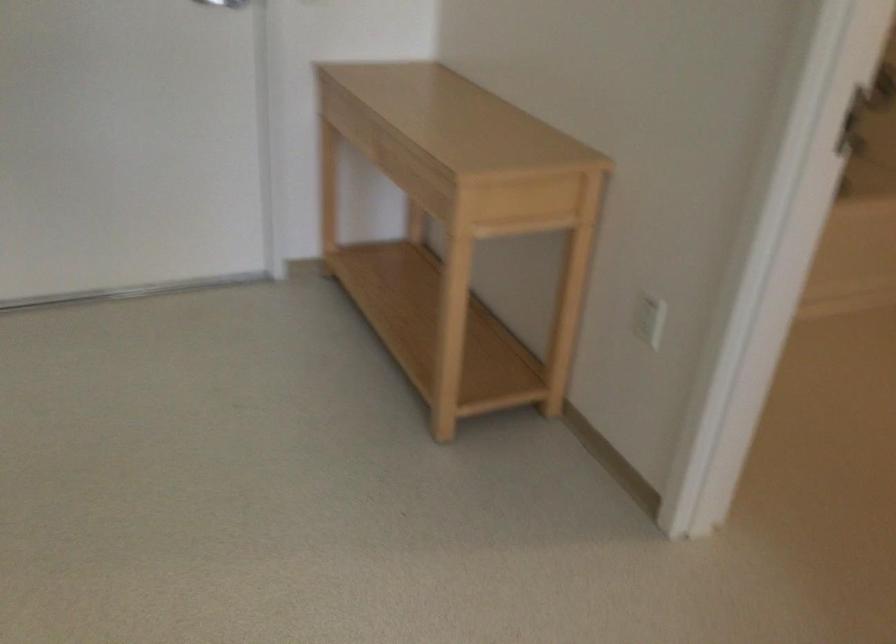
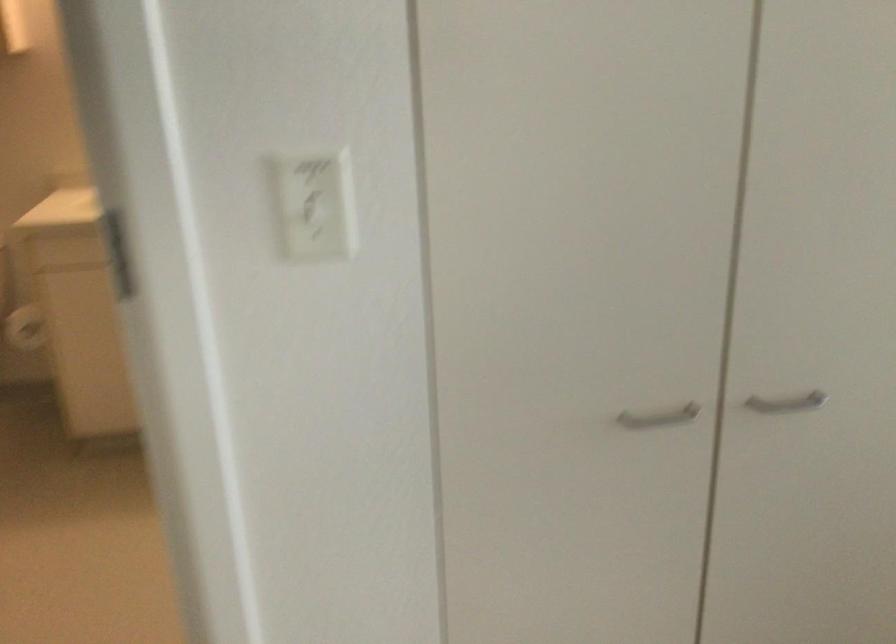
Based on the continuous images, in which direction is the camera rotating?

The camera rotated toward right-down.